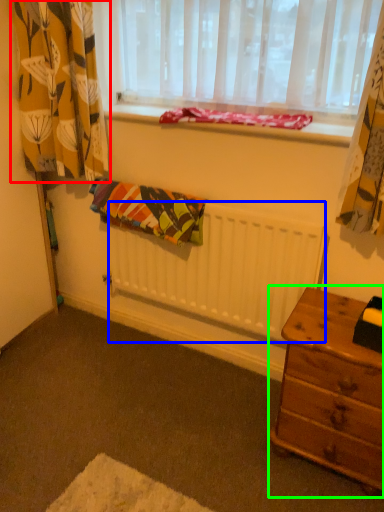
Question: Based on their relative distances, which object is nearer to curtain (highlighted by a red box)? Choose from radiator (highlighted by a blue box) and nightstand (highlighted by a green box).

Choices:
 (A) radiator
 (B) nightstand

Answer: (A)